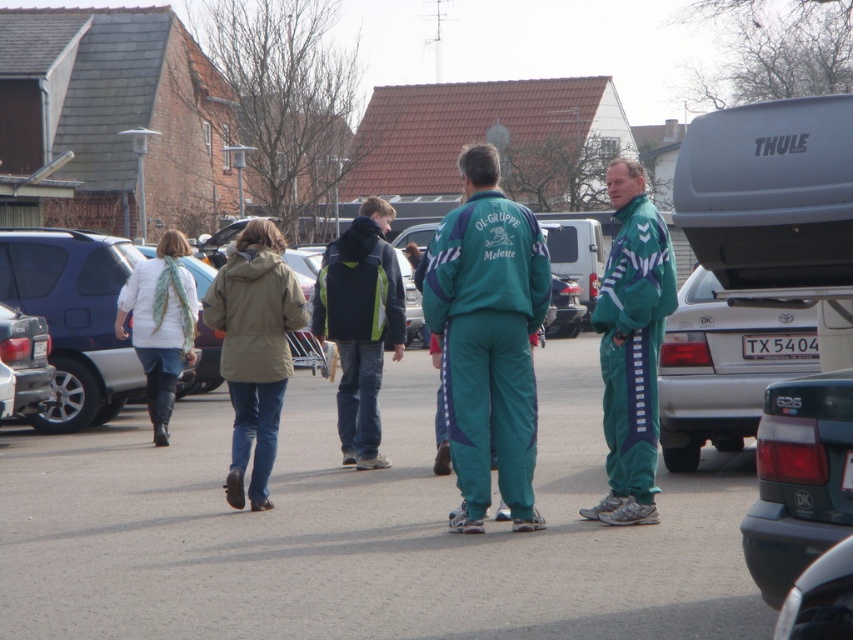
You are a photographer trying to capture a shot of both the teal fabric pants at center and the khaki fabric jacket at lower left. Since you want to include both in the frame, which object should you position closer to the center of your camera viewfinder to ensure both are visible?

The khaki fabric jacket at lower left should be positioned closer to the center of the camera viewfinder because the teal fabric pants at center is already on the right side of it, so centering the jacket would allow the pants to be on the right side within the frame.

You are a photographer trying to capture a photo of the dark green plastic car at lower right without including the teal fabric pants at center in the frame. Based on their sizes, is this possible?

The teal fabric pants at center is not as tall as dark green plastic car at lower right, so it is possible to frame the photo so that the dark green plastic car at lower right is visible without the teal fabric pants at center blocking it.